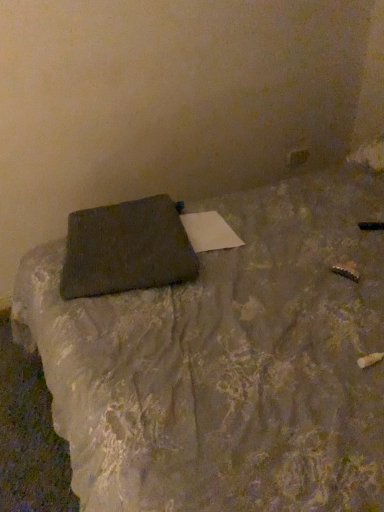
Question: From a real-world perspective, relative to brown textured pillow at center, is matte black folder at center vertically above or below?

Choices:
 (A) below
 (B) above

Answer: (B)

Question: Considering the positions of matte black folder at center and brown textured pillow at center in the image, is matte black folder at center wider or thinner than brown textured pillow at center?

Choices:
 (A) wide
 (B) thin

Answer: (A)

Question: Is point (352, 324) positioned closer to the camera than point (117, 253)?

Choices:
 (A) closer
 (B) farther

Answer: (A)

Question: Is brown textured pillow at center inside the boundaries of matte black folder at center, or outside?

Choices:
 (A) outside
 (B) inside

Answer: (B)

Question: Looking at the image, does brown textured pillow at center seem bigger or smaller compared to matte black folder at center?

Choices:
 (A) small
 (B) big

Answer: (A)

Question: Is point (155, 211) closer or farther from the camera than point (155, 431)?

Choices:
 (A) farther
 (B) closer

Answer: (A)

Question: Visually, is brown textured pillow at center positioned to the left or to the right of matte black folder at center?

Choices:
 (A) right
 (B) left

Answer: (B)